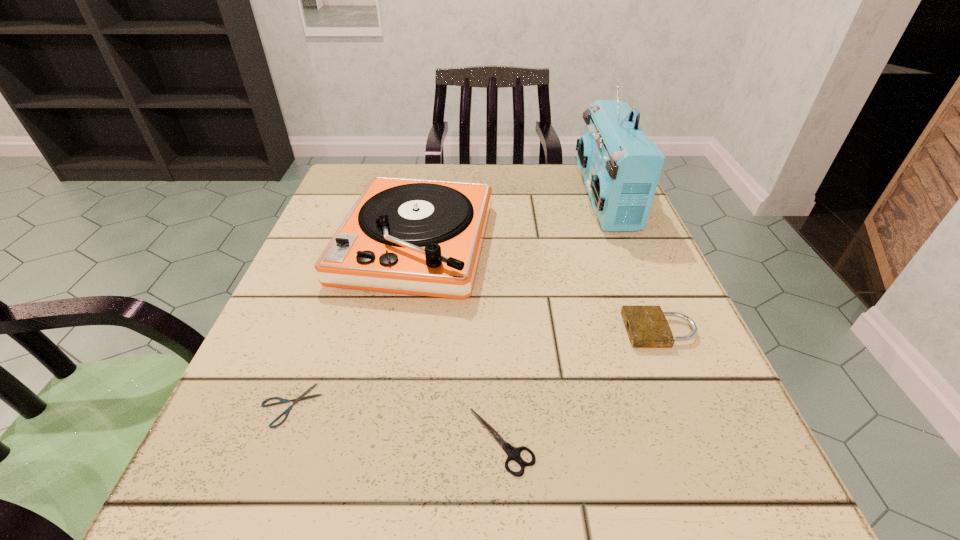
Where is `unoccupied position between the padlock and the shortest object`? unoccupied position between the padlock and the shortest object is located at coordinates (475, 368).

Find the location of a particular element. The height and width of the screenshot is (540, 960). vacant area that lies between the shorter shears and the radio receiver is located at coordinates (447, 301).

Select which object is the closest to the second tallest object. Please provide its 2D coordinates. Your answer should be formatted as a tuple, i.e. [(x, y)], where the tuple contains the x and y coordinates of a point satisfying the conditions above.

[(300, 398)]

Locate which object is the second closest to the left shears. Please provide its 2D coordinates. Your answer should be formatted as a tuple, i.e. [(x, y)], where the tuple contains the x and y coordinates of a point satisfying the conditions above.

[(513, 453)]

You are a GUI agent. You are given a task and a screenshot of the screen. Output one action in this format:
    pyautogui.click(x=<x>, y=<y>)
    Task: Click on the vacant area that satisfies the following two spatial constraints: 1. on the keyhole side of the third tallest object; 2. on the front side of the taller shears
    The width and height of the screenshot is (960, 540).
    Given the screenshot: What is the action you would take?
    706,441